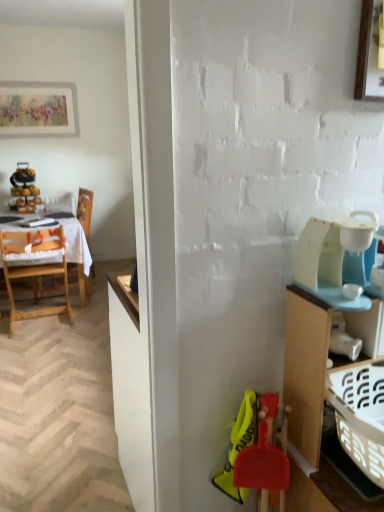
Question: Considering the positions of point (321, 419) and point (38, 117), is point (321, 419) closer or farther from the camera than point (38, 117)?

Choices:
 (A) farther
 (B) closer

Answer: (B)

Question: From the image's perspective, is wooden cabinet at right positioned above or below matte white picture frame at upper left, which appears as the 1th picture frame when viewed from the left?

Choices:
 (A) below
 (B) above

Answer: (A)

Question: Estimate the real-world distances between objects in this image. Which object is farther from the white plastic coffee maker at right?

Choices:
 (A) wooden cabinet at right
 (B) white cloth at left
 (C) wooden chair at left, which is the second chair in front-to-back order
 (D) wooden chair at left, arranged as the second chair when viewed from the back
 (E) wooden picture frame at upper right, positioned as the second picture frame in top-to-bottom order

Answer: (C)

Question: Which object is positioned closest to the wooden cabinet at right?

Choices:
 (A) white plastic coffee maker at right
 (B) wooden chair at left, which is the second chair in front-to-back order
 (C) matte white picture frame at upper left, which ranks as the first picture frame in top-to-bottom order
 (D) wooden chair at left, the first chair positioned from the front
 (E) wooden picture frame at upper right, arranged as the first picture frame when ordered from the bottom

Answer: (A)